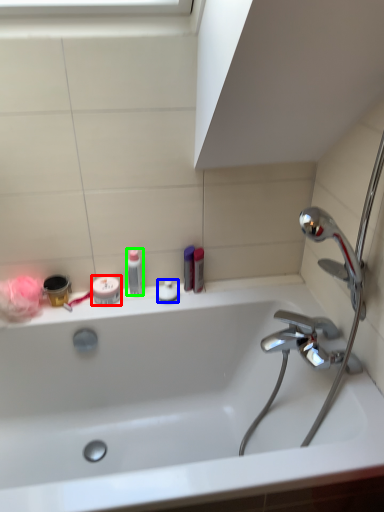
Question: Which object is positioned closest to mouthwash (highlighted by a red box)? Select from toiletry (highlighted by a blue box) and toiletry (highlighted by a green box).

Choices:
 (A) toiletry
 (B) toiletry

Answer: (B)